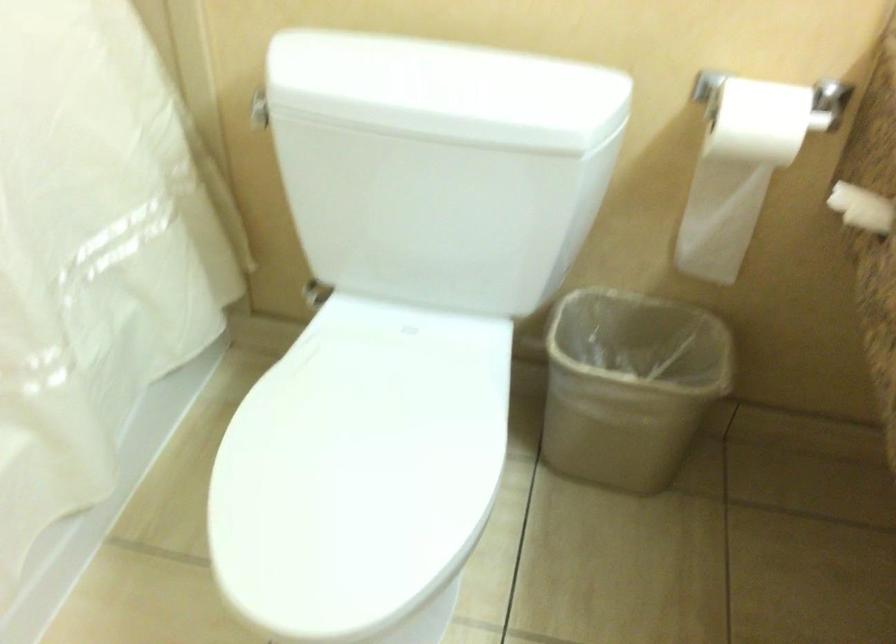
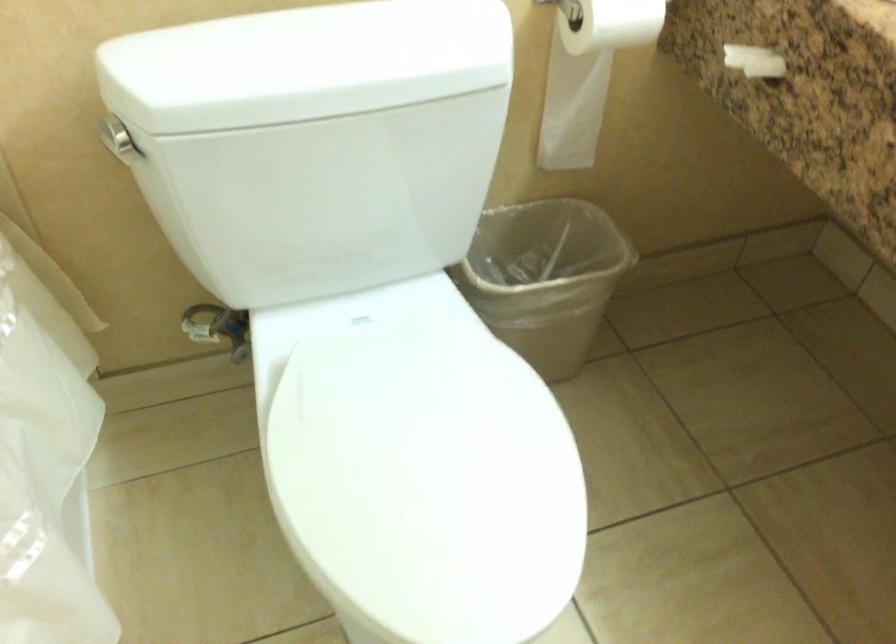
Question: The camera is either moving clockwise (left) or counter-clockwise (right) around the object. The first image is from the beginning of the video and the second image is from the end. Is the camera moving left or right when shooting the video?

Choices:
 (A) Left
 (B) Right

Answer: (A)